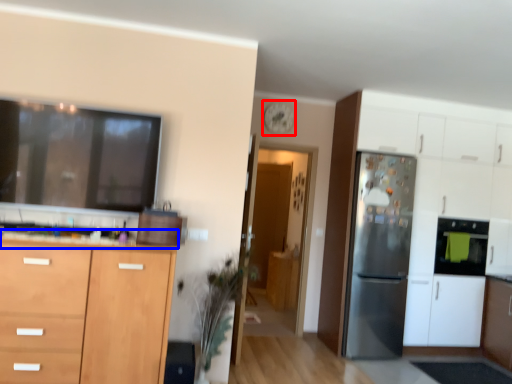
Question: Which object appears farthest to the camera in this image, clock (highlighted by a red box) or countertop (highlighted by a blue box)?

Choices:
 (A) clock
 (B) countertop

Answer: (A)